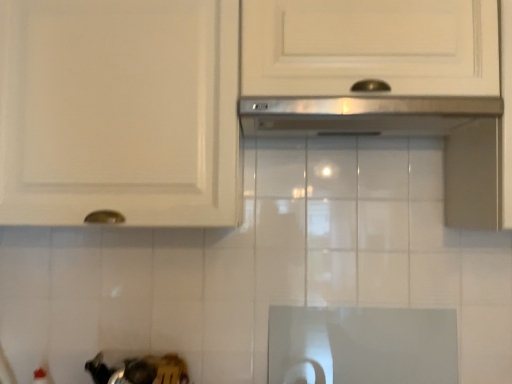
The height and width of the screenshot is (384, 512). Describe the element at coordinates (362, 115) in the screenshot. I see `stainless steel exhaust hood at center` at that location.

Locate an element on the screen. The width and height of the screenshot is (512, 384). stainless steel exhaust hood at center is located at coordinates (362, 115).

Based on the photo, measure the distance between white glossy cabinet at upper center and camera.

A distance of 94.66 centimeters exists between white glossy cabinet at upper center and camera.

Image resolution: width=512 pixels, height=384 pixels. I want to click on white glossy cabinet at upper center, so click(234, 98).

The width and height of the screenshot is (512, 384). What do you see at coordinates (234, 98) in the screenshot?
I see `white glossy cabinet at upper center` at bounding box center [234, 98].

You are a GUI agent. You are given a task and a screenshot of the screen. Output one action in this format:
    pyautogui.click(x=<x>, y=<y>)
    Task: Click on the stainless steel exhaust hood at center
    The height and width of the screenshot is (384, 512).
    Given the screenshot: What is the action you would take?
    point(362,115)

Between white glossy cabinet at upper center and stainless steel exhaust hood at center, which one appears on the left side from the viewer's perspective?

white glossy cabinet at upper center is more to the left.

Is white glossy cabinet at upper center further to the viewer compared to stainless steel exhaust hood at center?

Yes, white glossy cabinet at upper center is behind stainless steel exhaust hood at center.

Does point (383, 132) lie in front of point (251, 130)?

Yes, point (383, 132) is in front of point (251, 130).

From the picture: From the image's perspective, is white glossy cabinet at upper center above or below stainless steel exhaust hood at center?

Based on their image positions, white glossy cabinet at upper center is located above stainless steel exhaust hood at center.

From a real-world perspective, relative to stainless steel exhaust hood at center, is white glossy cabinet at upper center vertically above or below?

white glossy cabinet at upper center is above stainless steel exhaust hood at center.

Is white glossy cabinet at upper center wider than stainless steel exhaust hood at center?

No, white glossy cabinet at upper center is not wider than stainless steel exhaust hood at center.

Can you confirm if white glossy cabinet at upper center is shorter than stainless steel exhaust hood at center?

In fact, white glossy cabinet at upper center may be taller than stainless steel exhaust hood at center.

Considering the relative sizes of white glossy cabinet at upper center and stainless steel exhaust hood at center in the image provided, is white glossy cabinet at upper center smaller than stainless steel exhaust hood at center?

No.

Can we say white glossy cabinet at upper center lies outside stainless steel exhaust hood at center?

white glossy cabinet at upper center lies outside stainless steel exhaust hood at center's area.

Is white glossy cabinet at upper center placed right next to stainless steel exhaust hood at center?

white glossy cabinet at upper center and stainless steel exhaust hood at center are not in contact.

Is white glossy cabinet at upper center turned away from stainless steel exhaust hood at center?

Correct, white glossy cabinet at upper center is looking away from stainless steel exhaust hood at center.

How different are the orientations of white glossy cabinet at upper center and stainless steel exhaust hood at center in degrees?

The angle between the facing direction of white glossy cabinet at upper center and the facing direction of stainless steel exhaust hood at center is 0.691 degrees.

Measure the distance between white glossy cabinet at upper center and stainless steel exhaust hood at center.

white glossy cabinet at upper center is 6.60 inches away from stainless steel exhaust hood at center.

The height and width of the screenshot is (384, 512). Find the location of `cabinetry behind the stainless steel exhaust hood at center`. cabinetry behind the stainless steel exhaust hood at center is located at coordinates (234, 98).

Visually, is stainless steel exhaust hood at center positioned to the left or to the right of white glossy cabinet at upper center?

stainless steel exhaust hood at center is positioned on white glossy cabinet at upper center's right side.

Is stainless steel exhaust hood at center in front of or behind white glossy cabinet at upper center in the image?

Visually, stainless steel exhaust hood at center is located in front of white glossy cabinet at upper center.

Is point (492, 108) behind point (147, 5)?

No.

From the image's perspective, is stainless steel exhaust hood at center on white glossy cabinet at upper center?

No, from the image's perspective, stainless steel exhaust hood at center is not above white glossy cabinet at upper center.

From a real-world perspective, is stainless steel exhaust hood at center on white glossy cabinet at upper center?

No, from a real-world perspective, stainless steel exhaust hood at center is not above white glossy cabinet at upper center.

Considering the sizes of stainless steel exhaust hood at center and white glossy cabinet at upper center in the image, is stainless steel exhaust hood at center wider or thinner than white glossy cabinet at upper center?

Considering their sizes, stainless steel exhaust hood at center looks broader than white glossy cabinet at upper center.

Considering the sizes of objects stainless steel exhaust hood at center and white glossy cabinet at upper center in the image provided, who is shorter, stainless steel exhaust hood at center or white glossy cabinet at upper center?

With less height is stainless steel exhaust hood at center.

Considering the sizes of objects stainless steel exhaust hood at center and white glossy cabinet at upper center in the image provided, who is smaller, stainless steel exhaust hood at center or white glossy cabinet at upper center?

stainless steel exhaust hood at center.

Is stainless steel exhaust hood at center completely or partially outside of white glossy cabinet at upper center?

Actually, stainless steel exhaust hood at center is within white glossy cabinet at upper center.

Is stainless steel exhaust hood at center far from white glossy cabinet at upper center?

No.

Is stainless steel exhaust hood at center aimed at white glossy cabinet at upper center?

Yes.

How many degrees apart are the facing directions of stainless steel exhaust hood at center and white glossy cabinet at upper center?

The angular difference between stainless steel exhaust hood at center and white glossy cabinet at upper center is 0.691 degrees.

Locate an element on the screen. cabinetry above the stainless steel exhaust hood at center (from the image's perspective) is located at coordinates (234, 98).

Where is `cabinetry lying on the left of stainless steel exhaust hood at center`? The image size is (512, 384). cabinetry lying on the left of stainless steel exhaust hood at center is located at coordinates (234, 98).

The height and width of the screenshot is (384, 512). What are the coordinates of `exhaust hood in front of the white glossy cabinet at upper center` in the screenshot? It's located at tap(362, 115).